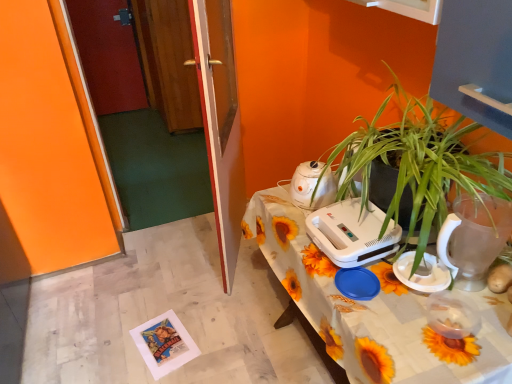
You are a GUI agent. You are given a task and a screenshot of the screen. Output one action in this format:
    pyautogui.click(x=<x>, y=<y>)
    Task: Click on the vacant area situated to the left side of white plastic plate at lower right, acting as the second appliance starting from the front
    Image resolution: width=512 pixels, height=384 pixels.
    Given the screenshot: What is the action you would take?
    pyautogui.click(x=368, y=291)